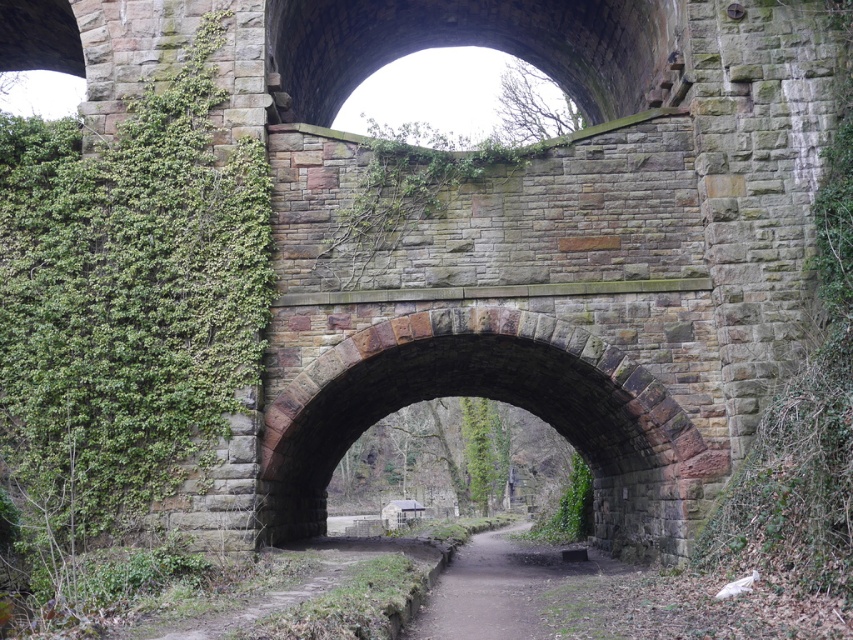
Question: Does green leafy ivy at left have a greater width compared to dull brown dirt path at center?

Choices:
 (A) no
 (B) yes

Answer: (B)

Question: Which of the following is the farthest from the observer?

Choices:
 (A) green leafy ivy at left
 (B) dull brown dirt path at center

Answer: (A)

Question: Is green leafy ivy at left positioned in front of dull brown dirt path at center?

Choices:
 (A) yes
 (B) no

Answer: (B)

Question: Does green leafy ivy at left have a larger size compared to dull brown dirt path at center?

Choices:
 (A) no
 (B) yes

Answer: (B)

Question: Among these objects, which one is nearest to the camera?

Choices:
 (A) dull brown dirt path at center
 (B) green leafy ivy at left

Answer: (A)